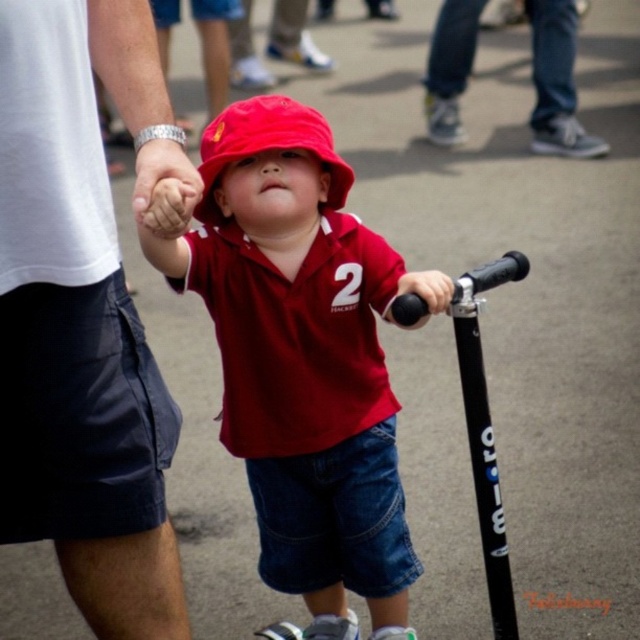
Question: Can you confirm if white cotton shirt at left is positioned below denim jeans at lower right?

Choices:
 (A) yes
 (B) no

Answer: (A)

Question: Which point appears closest to the camera in this image?

Choices:
 (A) pos(221,116)
 (B) pos(160,141)
 (C) pos(428,291)

Answer: (B)

Question: Can you confirm if white cotton shirt at left is bigger than matte red bucket hat at center?

Choices:
 (A) yes
 (B) no

Answer: (A)

Question: Does white cotton shirt at left have a greater width compared to black rubber handlebar at center?

Choices:
 (A) no
 (B) yes

Answer: (B)

Question: Which point appears closest to the camera in this image?

Choices:
 (A) (413, 282)
 (B) (115, 545)
 (C) (458, 10)
 (D) (147, 188)

Answer: (D)

Question: Considering the real-world distances, which object is farthest from the matte red bucket hat at center?

Choices:
 (A) white cotton shirt at left
 (B) black rubber handlebar at center

Answer: (A)